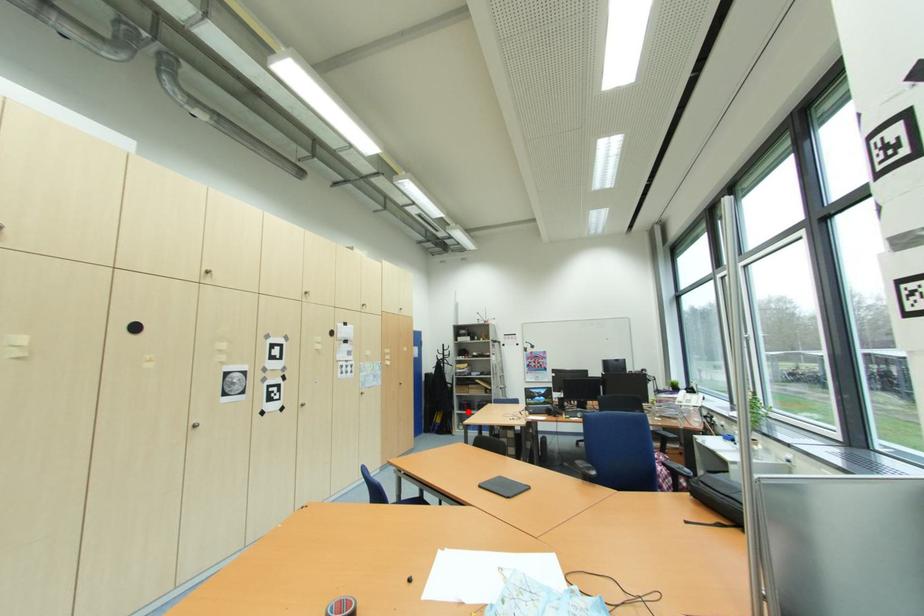
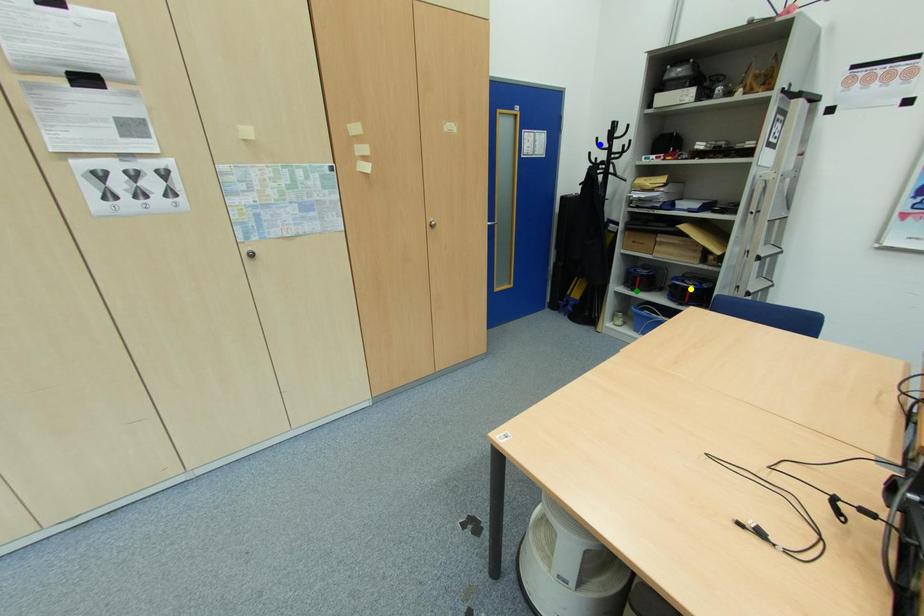
Question: I am providing you with two images of the same scene from different viewpoints. A red point is marked on the first image. You are given multiple points on the second image. Which spot in image 2 lines up with the point in image 1?

Choices:
 (A) blue point
 (B) yellow point
 (C) green point

Answer: (C)